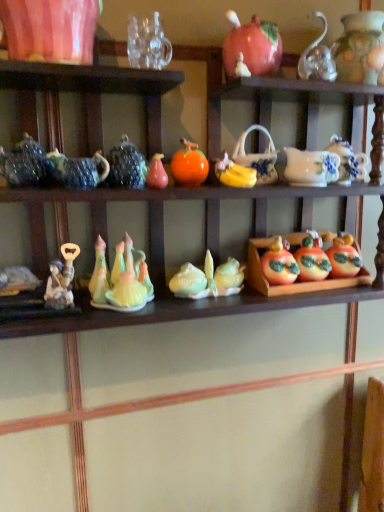
Question: Could you tell me if matte ceramic apples at center right is turned towards black glossy teapot at upper center, arranged as the fourth tableware when viewed from the right?

Choices:
 (A) no
 (B) yes

Answer: (A)

Question: Is matte ceramic apples at center right taller than black glossy teapot at upper center, arranged as the second tableware when viewed from the left?

Choices:
 (A) yes
 (B) no

Answer: (A)

Question: Does matte ceramic apples at center right have a greater width compared to black glossy teapot at upper center, arranged as the fourth tableware when viewed from the right?

Choices:
 (A) no
 (B) yes

Answer: (B)

Question: From the image's perspective, would you say matte ceramic apples at center right is positioned over black glossy teapot at upper center, arranged as the fourth tableware when viewed from the right?

Choices:
 (A) no
 (B) yes

Answer: (A)

Question: Does matte ceramic apples at center right come behind black glossy teapot at upper center, arranged as the second tableware when viewed from the left?

Choices:
 (A) yes
 (B) no

Answer: (A)

Question: Is matte ceramic apples at center right placed right next to black glossy teapot at upper center, arranged as the fourth tableware when viewed from the right?

Choices:
 (A) yes
 (B) no

Answer: (B)

Question: Is pear-shaped ceramic at center, positioned as the first toy in left-to-right order, not inside matte ceramic apples at center right?

Choices:
 (A) no
 (B) yes

Answer: (B)

Question: Is pear-shaped ceramic at center, placed as the first toy when sorted from front to back, far away from matte ceramic apples at center right?

Choices:
 (A) no
 (B) yes

Answer: (A)

Question: From the image's perspective, is pear-shaped ceramic at center, which is the third toy from back to front, over matte ceramic apples at center right?

Choices:
 (A) yes
 (B) no

Answer: (A)

Question: Is pear-shaped ceramic at center, the 3th toy ordered from the bottom, taller than matte ceramic apples at center right?

Choices:
 (A) no
 (B) yes

Answer: (A)

Question: Can you confirm if pear-shaped ceramic at center, the 1th toy when ordered from top to bottom, is positioned to the left of matte ceramic apples at center right?

Choices:
 (A) yes
 (B) no

Answer: (A)

Question: Does pear-shaped ceramic at center, which is counted as the third toy, starting from the right, appear on the right side of matte ceramic apples at center right?

Choices:
 (A) yes
 (B) no

Answer: (B)

Question: Is transparent glass teapot at upper right, the fifth tableware from the left, facing away from matte ceramic corn at center, the 2th toy from the back?

Choices:
 (A) no
 (B) yes

Answer: (A)